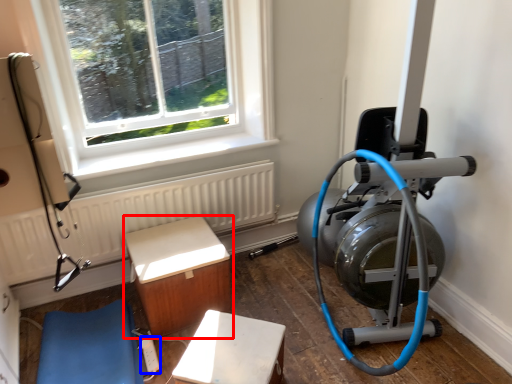
Question: Among these objects, which one is farthest to the camera, furniture (highlighted by a red box) or extension cord (highlighted by a blue box)?

Choices:
 (A) furniture
 (B) extension cord

Answer: (A)